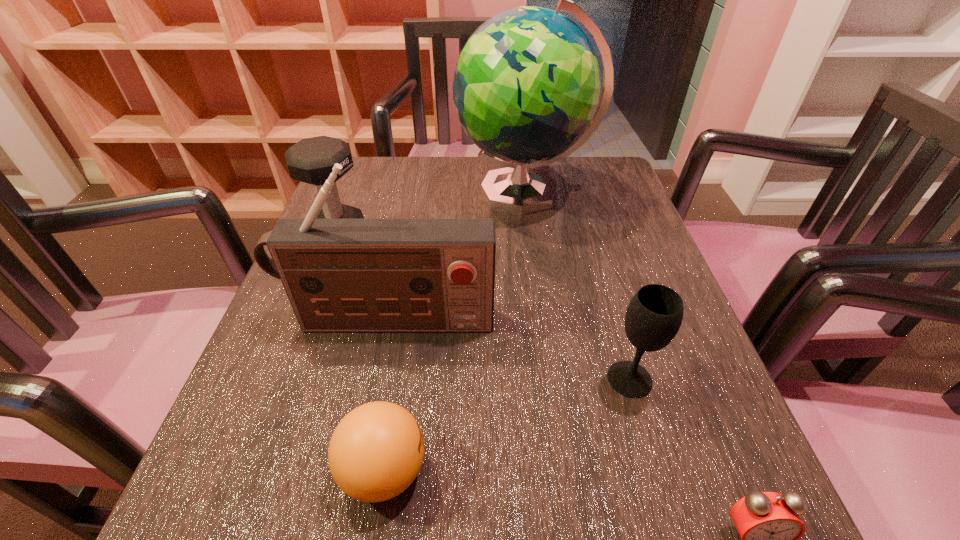
Where is `free area in between the fifth tallest object and the tallest object`? free area in between the fifth tallest object and the tallest object is located at coordinates (454, 332).

Select which object appears as the third closest to the ping-pong ball. Please provide its 2D coordinates. Your answer should be formatted as a tuple, i.e. [(x, y)], where the tuple contains the x and y coordinates of a point satisfying the conditions above.

[(768, 523)]

Choose which object is the third nearest neighbor to the shortest object. Please provide its 2D coordinates. Your answer should be formatted as a tuple, i.e. [(x, y)], where the tuple contains the x and y coordinates of a point satisfying the conditions above.

[(340, 275)]

Find the location of a particular element. Image resolution: width=960 pixels, height=540 pixels. free point that satisfies the following two spatial constraints: 1. on the front panel of the second tallest object; 2. on the right side of the wineglass is located at coordinates (377, 379).

Find the location of `vacant region that satisfies the following two spatial constraints: 1. on the front surface of the fourth farthest object; 2. on the left side of the globe`. vacant region that satisfies the following two spatial constraints: 1. on the front surface of the fourth farthest object; 2. on the left side of the globe is located at coordinates (550, 379).